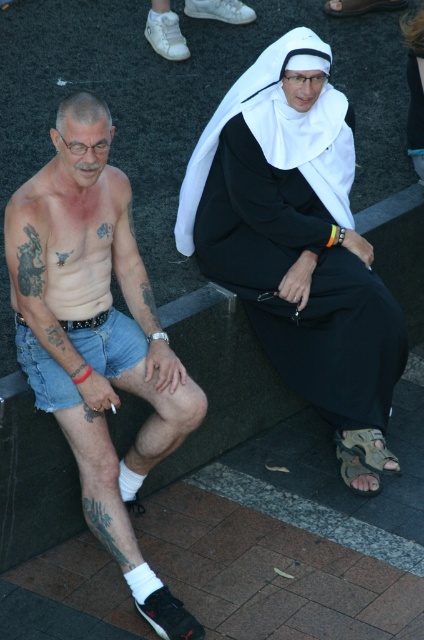
Does denim shorts at left have a smaller size compared to black matte tattoo at lower left?

Incorrect, denim shorts at left is not smaller in size than black matte tattoo at lower left.

Can you confirm if denim shorts at left is positioned above black matte tattoo at lower left?

Indeed, denim shorts at left is positioned over black matte tattoo at lower left.

Is point (44, 240) positioned in front of point (125, 531)?

Yes, it is in front of point (125, 531).

The width and height of the screenshot is (424, 640). Find the location of `denim shorts at left`. denim shorts at left is located at coordinates (94, 308).

Is denim shorts at lower left above brown leather sandal at lower center?

Yes.

Which is in front, point (24, 344) or point (359, 440)?

Point (24, 344) is more forward.

You are a GUI agent. You are given a task and a screenshot of the screen. Output one action in this format:
    pyautogui.click(x=<x>, y=<y>)
    Task: Click on the denim shorts at lower left
    
    Given the screenshot: What is the action you would take?
    pyautogui.click(x=108, y=342)

Is point (365, 440) less distant than point (94, 524)?

No, (365, 440) is further to viewer.

Which is in front, point (349, 470) or point (117, 516)?

Positioned in front is point (117, 516).

Image resolution: width=424 pixels, height=640 pixels. I want to click on brown leather sandal at lower center, so click(362, 458).